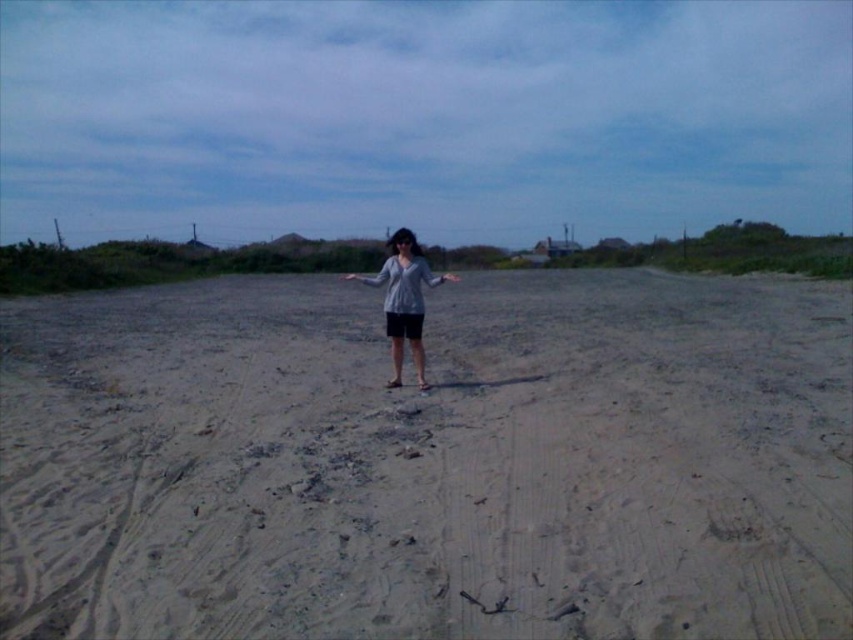
You are standing at the point marked by the coordinates (428, 460). Based on the scene description, what type of terrain would you expect to find under your feet?

The point marked by the coordinates (428, 460) corresponds to light brown sandy ground at center, so you would expect to find sandy terrain under your feet.

You are a photographer standing at the edge of the sandy area. You want to place a 2 meter tall statue exactly halfway between the light brown sandy ground at center and the gray matte sweater at center. Will the statue fit entirely within the sandy area without overlapping the ground or the sweater?

The distance between the light brown sandy ground at center and the gray matte sweater at center is 6.66 meters. Halfway would be 3.33 meters from each. Since the statue is 2 meters tall, its height won